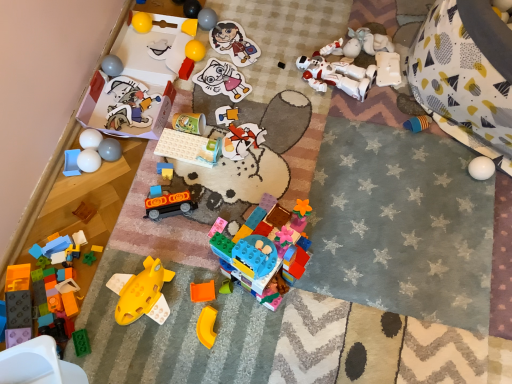
You are a GUI agent. You are given a task and a screenshot of the screen. Output one action in this format:
    pyautogui.click(x=<x>, y=<y>)
    Task: Click on the vacant space that's between matte plastic blocks at center, which appears as the fifteenth toy when viewed from the right, and white matte robot at center, marked as the third toy in a right-to-left arrangement
    The image size is (512, 384).
    Given the screenshot: What is the action you would take?
    pyautogui.click(x=269, y=117)